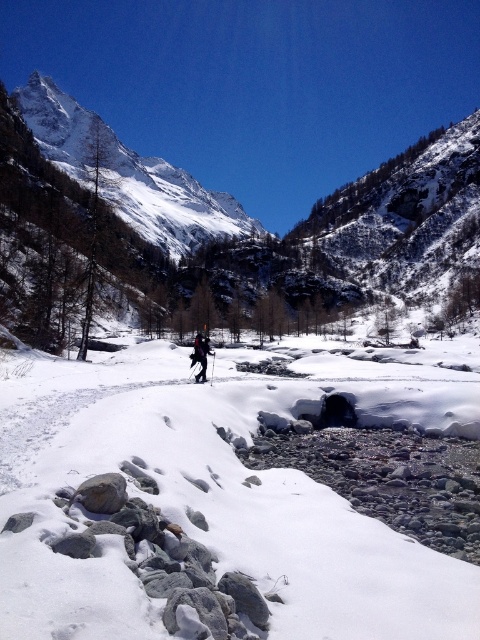
Question: From the image, what is the correct spatial relationship of snowy granite mountain at upper center in relation to black matte ski at center?

Choices:
 (A) above
 (B) below

Answer: (A)

Question: Which object is farther from the camera taking this photo?

Choices:
 (A) white powder snow at center
 (B) gray rock at lower left
 (C) snowy granite mountain at upper center

Answer: (C)

Question: Which object is positioned closest to the white powder snow at center?

Choices:
 (A) snowy granite mountain at upper center
 (B) black matte ski at center

Answer: (B)

Question: Can you confirm if white powder snow at center is positioned to the left of black matte ski at center?

Choices:
 (A) yes
 (B) no

Answer: (B)

Question: Which object is farther from the camera taking this photo?

Choices:
 (A) snowy granite mountain at upper center
 (B) gray rock at lower left
 (C) white powder snow at center
 (D) dark blue jacket at center

Answer: (A)

Question: Does white powder snow at center appear on the right side of snowy granite mountain at upper center?

Choices:
 (A) yes
 (B) no

Answer: (B)